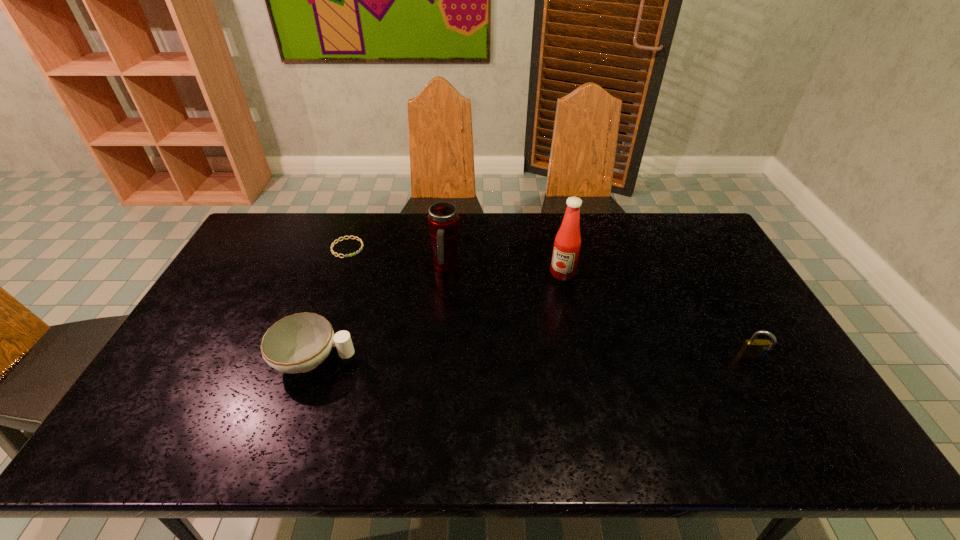
You are a GUI agent. You are given a task and a screenshot of the screen. Output one action in this format:
    pyautogui.click(x=<x>, y=<y>)
    Task: Click on the object present at the right edge
    
    Given the screenshot: What is the action you would take?
    pyautogui.click(x=754, y=348)

Locate an element on the screen. This screenshot has width=960, height=540. vacant space at the far edge of the desktop is located at coordinates (318, 252).

Where is `vacant space at the near edge of the desktop`? vacant space at the near edge of the desktop is located at coordinates (315, 413).

This screenshot has width=960, height=540. In the image, there is a desktop. Find the location of `vacant space at the left edge`. vacant space at the left edge is located at coordinates (184, 342).

You are a GUI agent. You are given a task and a screenshot of the screen. Output one action in this format:
    pyautogui.click(x=<x>, y=<y>)
    Task: Click on the vacant space at the right edge of the desktop
    The image size is (960, 540).
    Given the screenshot: What is the action you would take?
    pyautogui.click(x=701, y=297)

The image size is (960, 540). In the image, there is a desktop. Identify the location of vacant area at the far left corner. (295, 231).

In the image, there is a desktop. Find the location of `vacant region at the near left corner`. vacant region at the near left corner is located at coordinates (159, 393).

In the image, there is a desktop. Where is `blank space at the far right corner`? The image size is (960, 540). blank space at the far right corner is located at coordinates (673, 241).

Image resolution: width=960 pixels, height=540 pixels. I want to click on unoccupied position between the second object from right to left and the rightmost object, so click(658, 316).

You are a GUI agent. You are given a task and a screenshot of the screen. Output one action in this format:
    pyautogui.click(x=<x>, y=<y>)
    Task: Click on the vacant space that's between the fourth tallest object and the condiment
    Image resolution: width=960 pixels, height=540 pixels.
    Given the screenshot: What is the action you would take?
    pyautogui.click(x=439, y=317)